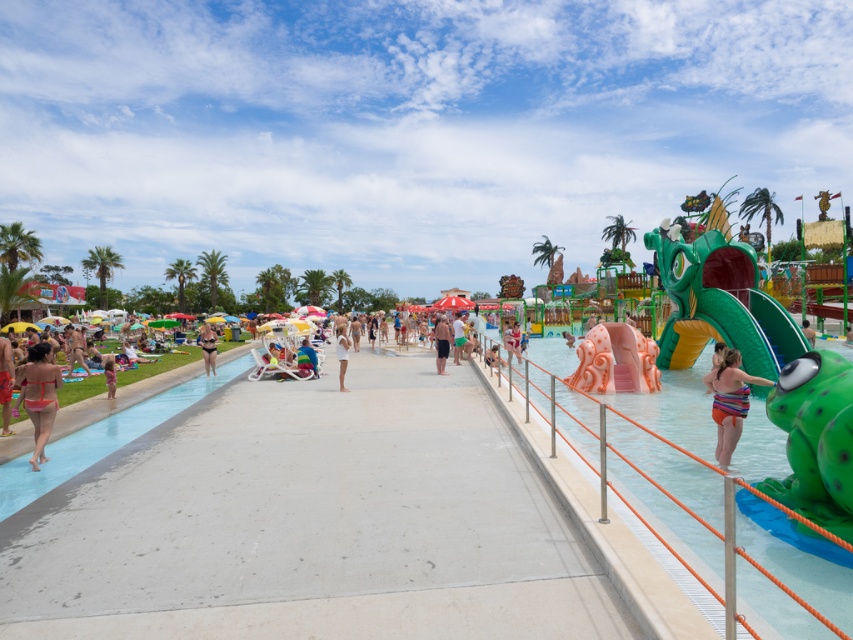
You are a lifeguard at the water park and need to ensure swimwear meets safety standards. The park requires that all swimwear must not exceed 12 inches in any dimension. You observe the striped fabric bikini at right and the matte pink bikini at left. Based on their sizes, which one is more likely to comply with the safety regulations?

The striped fabric bikini at right has a larger size compared to matte pink bikini at left. Since the park requires swimwear not to exceed 12 inches in any dimension, the matte pink bikini at left is more likely to comply with the safety regulations.

You are a photographer at the water park and want to capture both the striped fabric bikini at right and the matte pink bikini at left in a single frame. Which swimmer should you position closer to the camera to ensure both are fully visible in the photo?

The striped fabric bikini at right is much taller than the matte pink bikini at left. To ensure both are fully visible in the photo, position the striped fabric bikini at right closer to the camera so its height is balanced with the shorter matte pink bikini at left.

You are a lifeguard at the water park and need to ensure safety. You notice the smooth green pool at right and the matte black shorts at center. Which object requires closer monitoring for potential safety hazards, and why?

The smooth green pool at right requires closer monitoring because it is bigger than the matte black shorts at center, making it a larger area where incidents could occur.